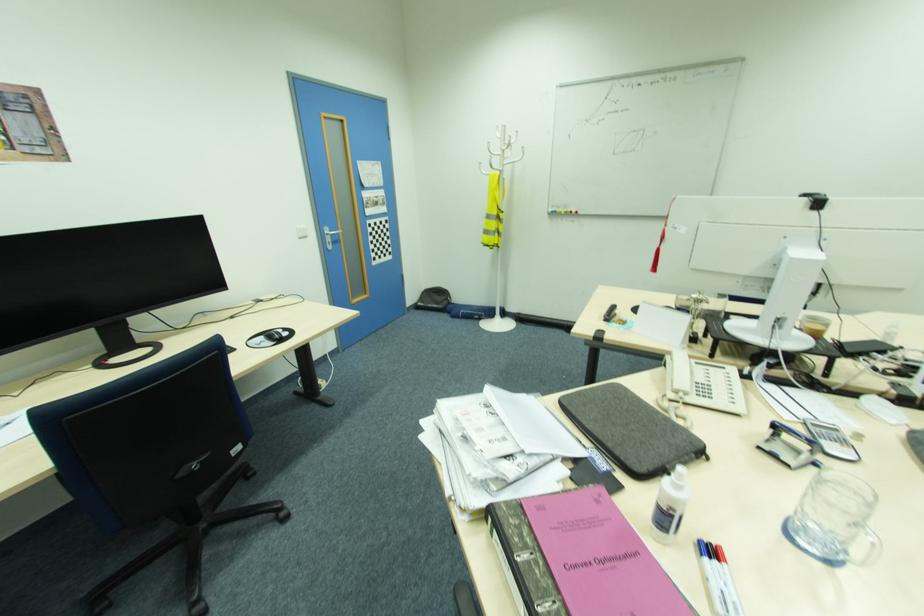
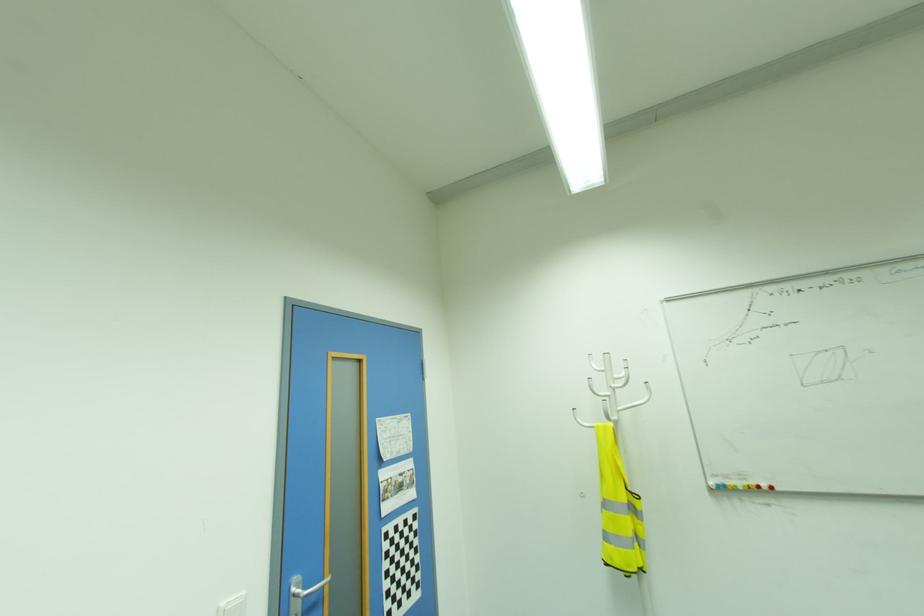
Question: I am providing you with two images of the same scene from different viewpoints. Please identify which objects are invisible in image2.

Choices:
 (A) white coat rack hook
 (B) white light switch
 (C) metal door handle
 (D) none of these

Answer: (D)